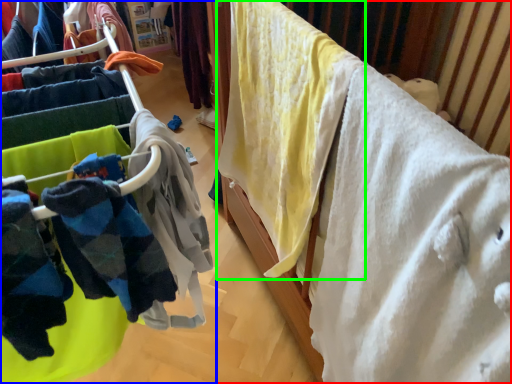
Question: Which is nearer to the furniture (highlighted by a red box)? closet (highlighted by a blue box) or clothing (highlighted by a green box).

Choices:
 (A) closet
 (B) clothing

Answer: (B)